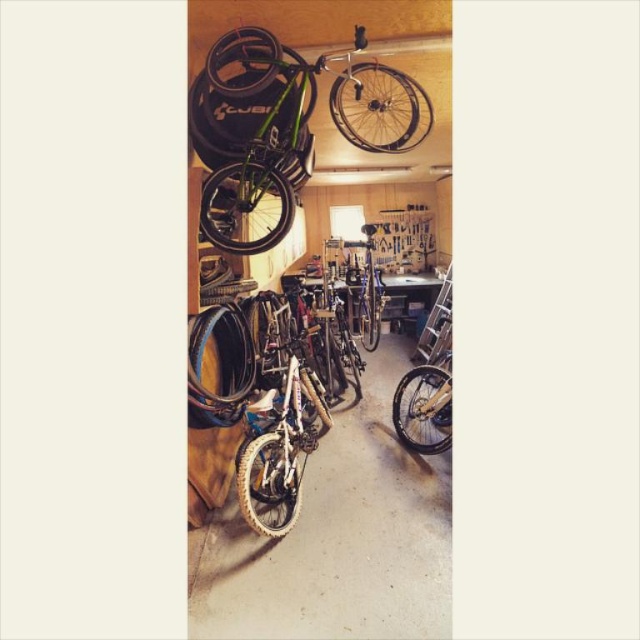
Question: Observing the image, what is the correct spatial positioning of black rubber tire at center in reference to yellow rubber tire at lower right?

Choices:
 (A) left
 (B) right

Answer: (A)

Question: Which of the following is the closest to the observer?

Choices:
 (A) black rubber tire at upper center
 (B) shiny silver rim at upper center

Answer: (A)

Question: Among these objects, which one is farthest from the camera?

Choices:
 (A) yellow rubber tire at lower right
 (B) white rubber tire at center

Answer: (A)

Question: Which object is closer to the camera taking this photo?

Choices:
 (A) white rubber tire at center
 (B) green matte bicycle at upper center
 (C) shiny silver rim at upper center
 (D) black rubber tire at upper center

Answer: (D)

Question: Does black rubber tire at center have a greater width compared to black rubber tire at upper center?

Choices:
 (A) yes
 (B) no

Answer: (A)

Question: Is shiny silver rim at upper center to the right of white rubber tire at center from the viewer's perspective?

Choices:
 (A) no
 (B) yes

Answer: (B)